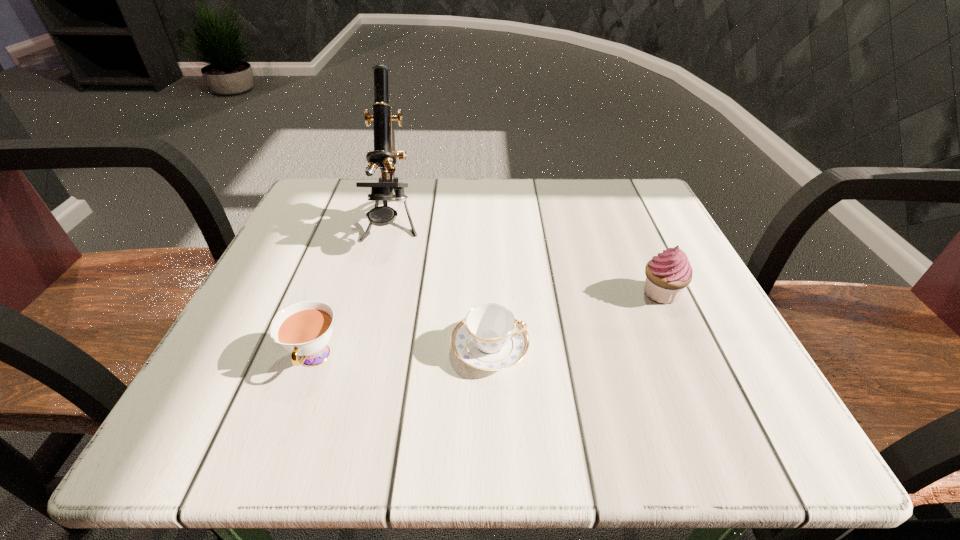
You are a GUI agent. You are given a task and a screenshot of the screen. Output one action in this format:
    pyautogui.click(x=<x>, y=<y>)
    Task: Click on the empty space that is in between the tallest object and the right teacup
    This screenshot has height=540, width=960.
    Given the screenshot: What is the action you would take?
    (x=442, y=287)

At what (x,y) coordinates should I click in order to perform the action: click on vacant area between the microscope and the second shortest object. Please return your answer as a coordinate pair (x, y). Looking at the image, I should click on (353, 292).

This screenshot has width=960, height=540. Find the location of `vacant area between the farthest object and the left teacup`. vacant area between the farthest object and the left teacup is located at coordinates (353, 292).

I want to click on free space between the right teacup and the rightmost object, so click(575, 321).

Identify which object is the third nearest to the third object from left to right. Please provide its 2D coordinates. Your answer should be formatted as a tuple, i.e. [(x, y)], where the tuple contains the x and y coordinates of a point satisfying the conditions above.

[(667, 274)]

Identify which object is the nearest to the tallest object. Please provide its 2D coordinates. Your answer should be formatted as a tuple, i.e. [(x, y)], where the tuple contains the x and y coordinates of a point satisfying the conditions above.

[(490, 338)]

This screenshot has height=540, width=960. I want to click on free region that satisfies the following two spatial constraints: 1. through the eyepiece of the second tallest object; 2. on the right side of the farthest object, so click(x=375, y=293).

Image resolution: width=960 pixels, height=540 pixels. I want to click on vacant position in the image that satisfies the following two spatial constraints: 1. on the side with the handle of the shortest object; 2. on the side of the third tallest object with the handle, so click(x=490, y=359).

At what (x,y) coordinates should I click in order to perform the action: click on free location that satisfies the following two spatial constraints: 1. through the eyepiece of the microscope; 2. on the right side of the cupcake. Please return your answer as a coordinate pair (x, y). Looking at the image, I should click on (375, 293).

At what (x,y) coordinates should I click in order to perform the action: click on free region that satisfies the following two spatial constraints: 1. on the side with the handle of the third object from left to right; 2. on the side of the left teacup with the handle. Please return your answer as a coordinate pair (x, y). Looking at the image, I should click on (490, 359).